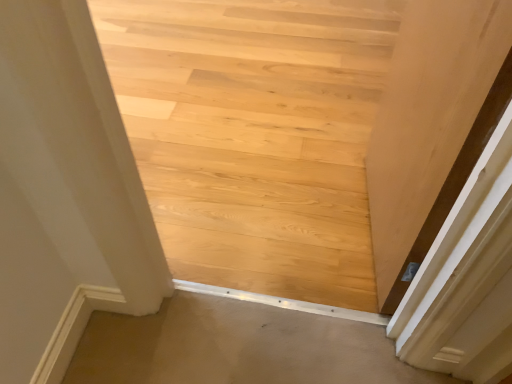
At what (x,y) coordinates should I click in order to perform the action: click on beige carpet at lower center. Please return your answer as a coordinate pair (x, y). This screenshot has height=384, width=512. Looking at the image, I should click on (236, 347).

In the image, there is a beige carpet at lower center. At what (x,y) coordinates should I click in order to perform the action: click on stairwell above it (from the image's perspective). Please return your answer as a coordinate pair (x, y). The image size is (512, 384). Looking at the image, I should click on (255, 136).

Between natural wood floor at center and beige carpet at lower center, which one has more height?

Standing taller between the two is natural wood floor at center.

From the image's perspective, is natural wood floor at center located above or below beige carpet at lower center?

natural wood floor at center is situated higher than beige carpet at lower center in the image.

Are beige carpet at lower center and matte wood door at right located far from each other?

Actually, beige carpet at lower center and matte wood door at right are a little close together.

Considering the positions of point (151, 344) and point (457, 109), is point (151, 344) closer or farther from the camera than point (457, 109)?

Point (151, 344) is positioned farther from the camera compared to point (457, 109).

Identify the location of door on the right of beige carpet at lower center. This screenshot has width=512, height=384. (433, 126).

Can you confirm if matte wood door at right is wider than natural wood floor at center?

No.

Is matte wood door at right positioned far away from natural wood floor at center?

No, matte wood door at right is not far from natural wood floor at center.

From a real-world perspective, between matte wood door at right and natural wood floor at center, who is vertically lower?

natural wood floor at center.

Measure the distance from matte wood door at right to natural wood floor at center.

33.75 inches.

From the image's perspective, which object appears higher, matte wood door at right or beige carpet at lower center?

matte wood door at right.

Which is more to the right, matte wood door at right or beige carpet at lower center?

matte wood door at right is more to the right.

Which of these two, matte wood door at right or beige carpet at lower center, stands shorter?

beige carpet at lower center is shorter.

In the image, is natural wood floor at center positioned in front of or behind matte wood door at right?

Clearly, natural wood floor at center is behind matte wood door at right.

Is matte wood door at right surrounded by natural wood floor at center?

No, matte wood door at right is not inside natural wood floor at center.

Is point (385, 56) closer to viewer compared to point (391, 103)?

That is False.

Visually, is natural wood floor at center positioned to the left or to the right of matte wood door at right?

natural wood floor at center is to the left of matte wood door at right.

Does beige carpet at lower center turn towards natural wood floor at center?

Yes, beige carpet at lower center is aimed at natural wood floor at center.

Can you confirm if beige carpet at lower center is shorter than natural wood floor at center?

Yes, beige carpet at lower center is shorter than natural wood floor at center.

From the image's perspective, is beige carpet at lower center located beneath natural wood floor at center?

Indeed, from the image's perspective, beige carpet at lower center is shown beneath natural wood floor at center.

You are a GUI agent. You are given a task and a screenshot of the screen. Output one action in this format:
    pyautogui.click(x=<x>, y=<y>)
    Task: Click on the stairwell that is above the beige carpet at lower center (from a real-world perspective)
    The image size is (512, 384).
    Given the screenshot: What is the action you would take?
    pyautogui.click(x=255, y=136)

Where is `door above the beige carpet at lower center (from the image's perspective)`? The width and height of the screenshot is (512, 384). door above the beige carpet at lower center (from the image's perspective) is located at coordinates tap(433, 126).

Considering their positions, is natural wood floor at center positioned further to matte wood door at right than beige carpet at lower center?

The object further to matte wood door at right is natural wood floor at center.

When comparing their distances from matte wood door at right, does beige carpet at lower center or natural wood floor at center seem further?

The object further to matte wood door at right is natural wood floor at center.

When comparing their distances from beige carpet at lower center, does matte wood door at right or natural wood floor at center seem closer?

The object closer to beige carpet at lower center is matte wood door at right.

Looking at the image, which one is located further to natural wood floor at center, beige carpet at lower center or matte wood door at right?

beige carpet at lower center is further to natural wood floor at center.

Looking at the image, which one is located closer to beige carpet at lower center, natural wood floor at center or matte wood door at right?

Based on the image, matte wood door at right appears to be nearer to beige carpet at lower center.

In the scene shown: Estimate the real-world distances between objects in this image. Which object is closer to natural wood floor at center, matte wood door at right or beige carpet at lower center?

matte wood door at right.

Locate an element on the screen. Image resolution: width=512 pixels, height=384 pixels. door between natural wood floor at center and beige carpet at lower center vertically is located at coordinates (433, 126).